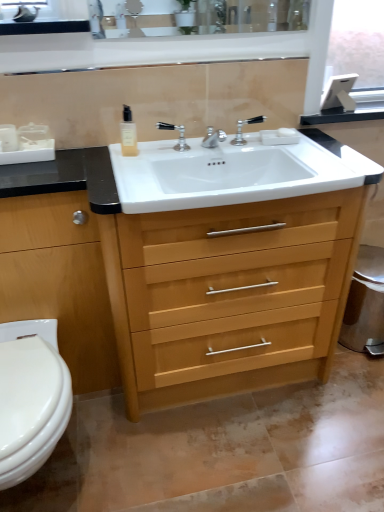
Locate an element on the screen. unoccupied region to the right of white glossy toilet at lower left is located at coordinates (148, 456).